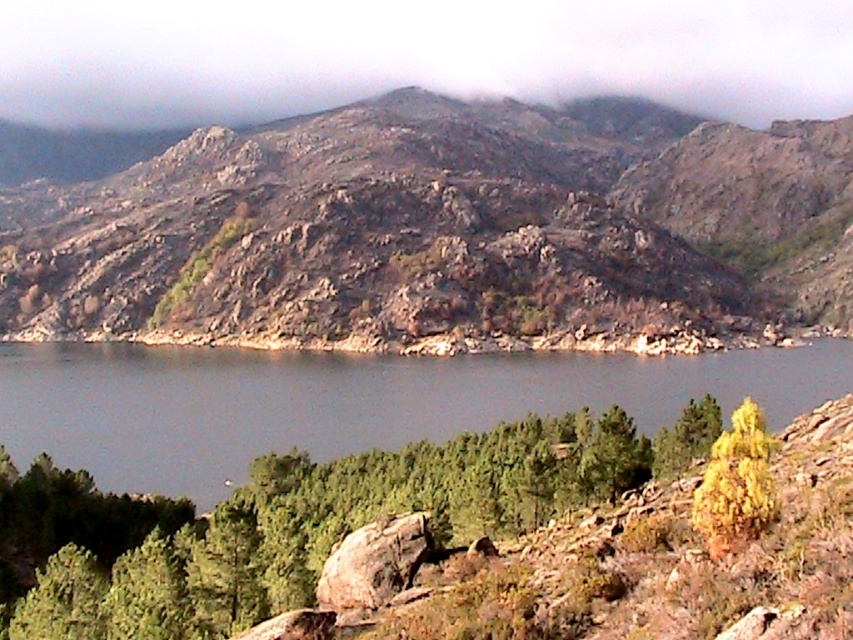
You are a hiker who wants to cross the gray smooth water at center. Based on its position, can you estimate whether it is located closer to the bottom or the top of the image?

The gray smooth water at center is located at point 0.628 on the x axis and 0.409 on the y axis. Since the y coordinate is 0.409, which is closer to the bottom of the image, the gray smooth water at center is closer to the bottom.